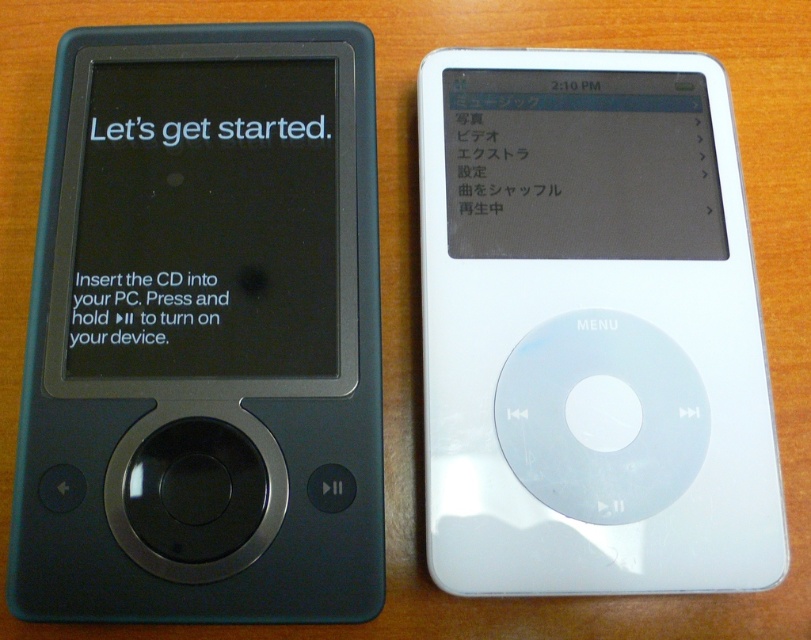
How much distance is there between matte black ipod at left and matte black screen at left?

matte black ipod at left is 1.19 inches away from matte black screen at left.

Which is in front, point (20, 493) or point (152, 99)?

Positioned in front is point (20, 493).

Find the location of a particular element. This screenshot has width=811, height=640. matte black ipod at left is located at coordinates (204, 326).

This screenshot has height=640, width=811. In order to click on matte black ipod at left in this screenshot , I will do `click(204, 326)`.

Can you confirm if white glossy ipod at right is bigger than matte black screen at upper right?

Indeed, white glossy ipod at right has a larger size compared to matte black screen at upper right.

Can you confirm if white glossy ipod at right is positioned to the left of matte black screen at upper right?

Incorrect, white glossy ipod at right is not on the left side of matte black screen at upper right.

Does point (576, 541) lie behind point (520, 72)?

No.

Locate an element on the screen. Image resolution: width=811 pixels, height=640 pixels. white glossy ipod at right is located at coordinates (590, 330).

In the scene shown: Can you confirm if matte black ipod at left is positioned to the right of white glossy ipod at right?

No, matte black ipod at left is not to the right of white glossy ipod at right.

Can you confirm if matte black ipod at left is thinner than white glossy ipod at right?

Incorrect, matte black ipod at left's width is not less than white glossy ipod at right's.

Is point (376, 422) positioned in front of point (455, 445)?

Yes, it is.

The image size is (811, 640). Find the location of `matte black ipod at left`. matte black ipod at left is located at coordinates (204, 326).